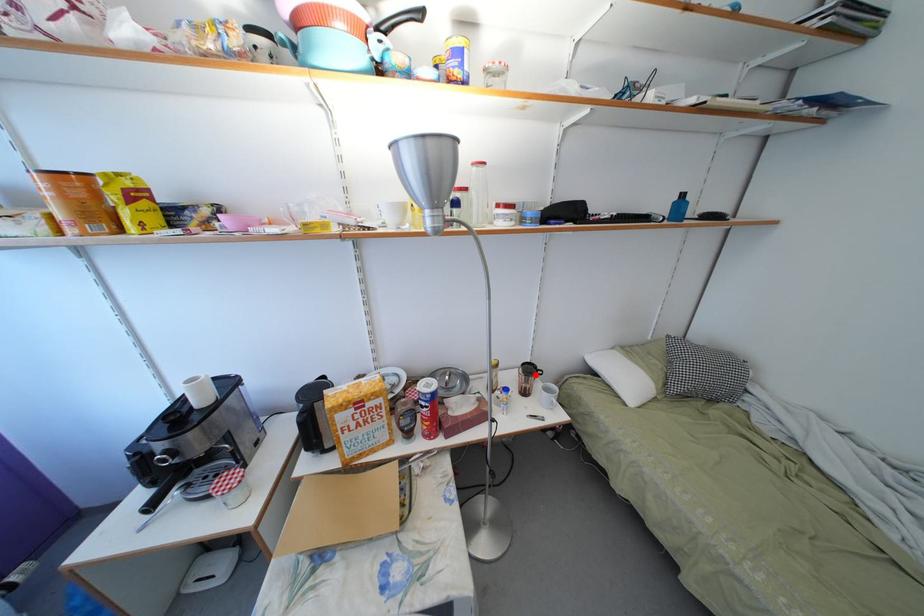
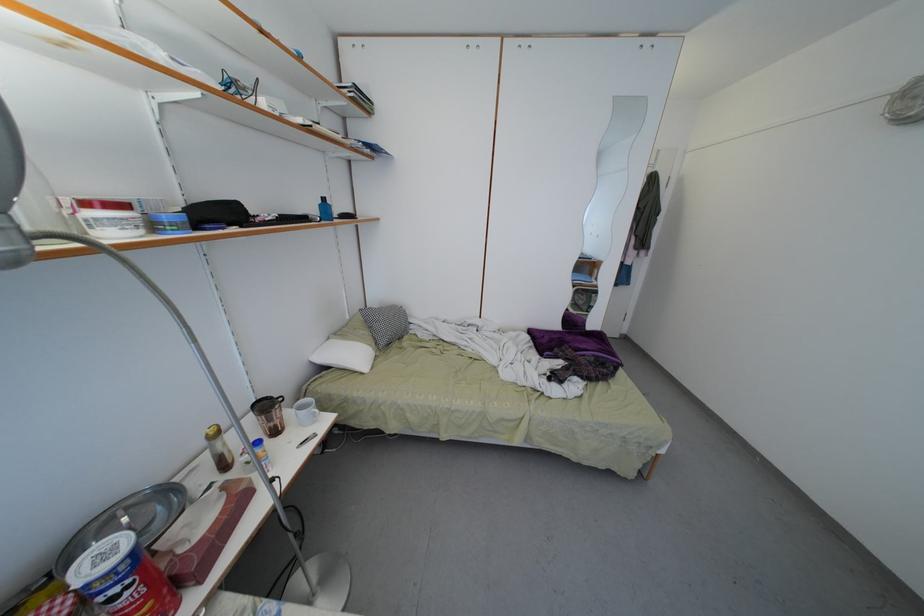
In the second image, find the point that corresponds to the highlighted location in the first image.

(271, 411)